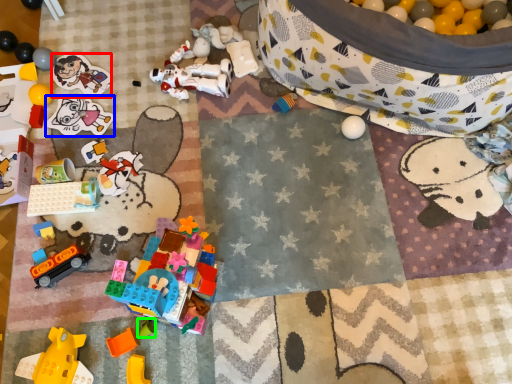
Question: Which is farther away from toy (highlighted by a red box)? toy (highlighted by a blue box) or toy (highlighted by a green box)?

Choices:
 (A) toy
 (B) toy

Answer: (B)